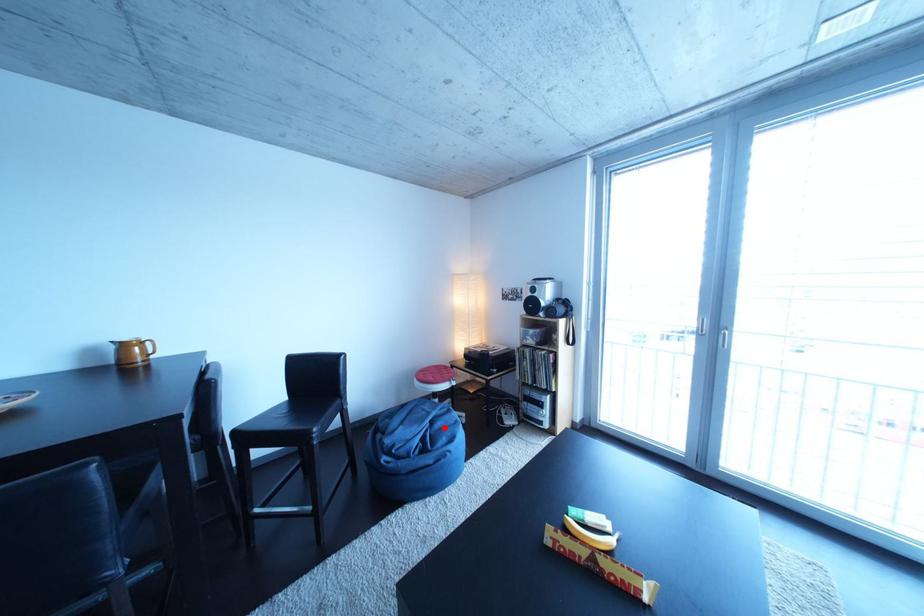
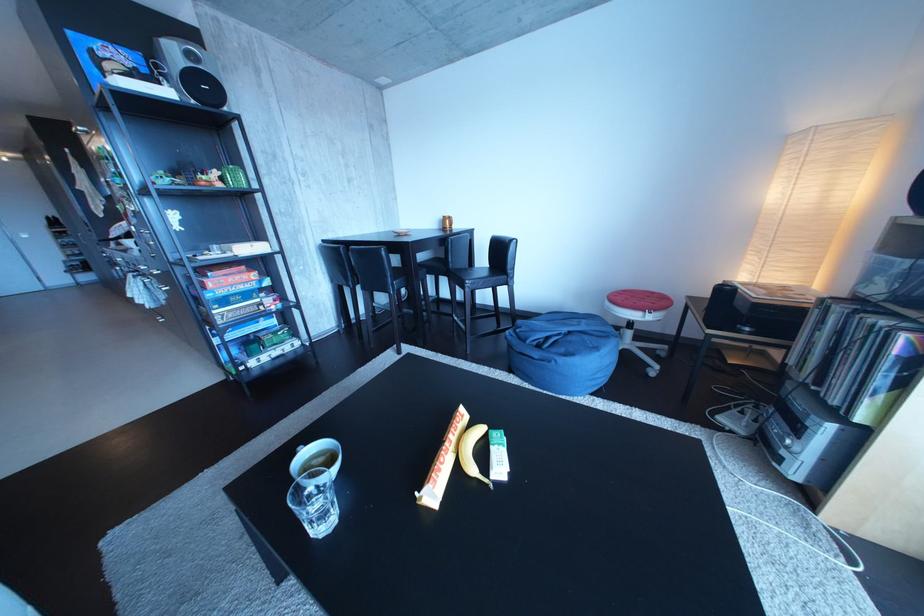
Question: I am providing you with two images of the same scene from different viewpoints. A red point is marked on the first image. Is the red point's position out of view in image 2?

Choices:
 (A) Yes
 (B) No

Answer: (B)